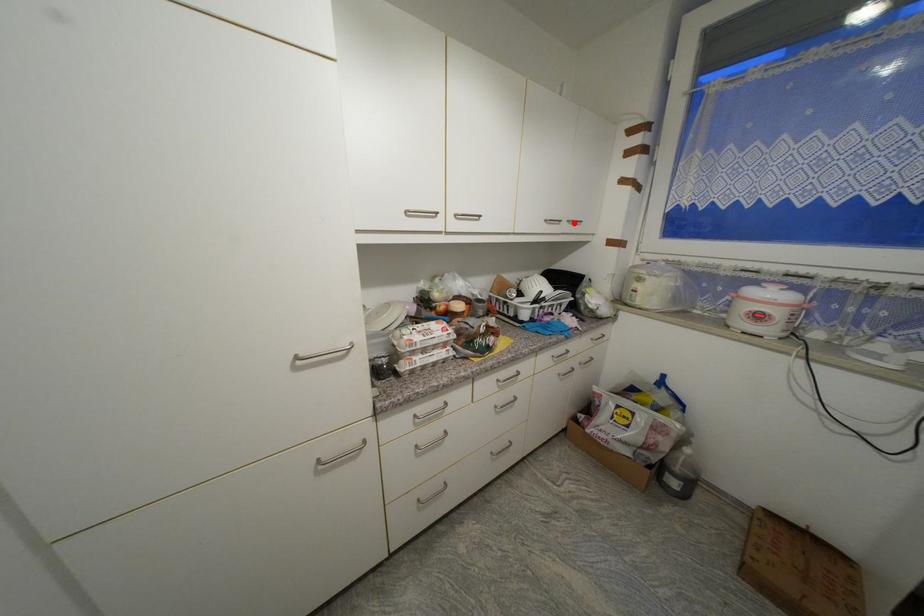
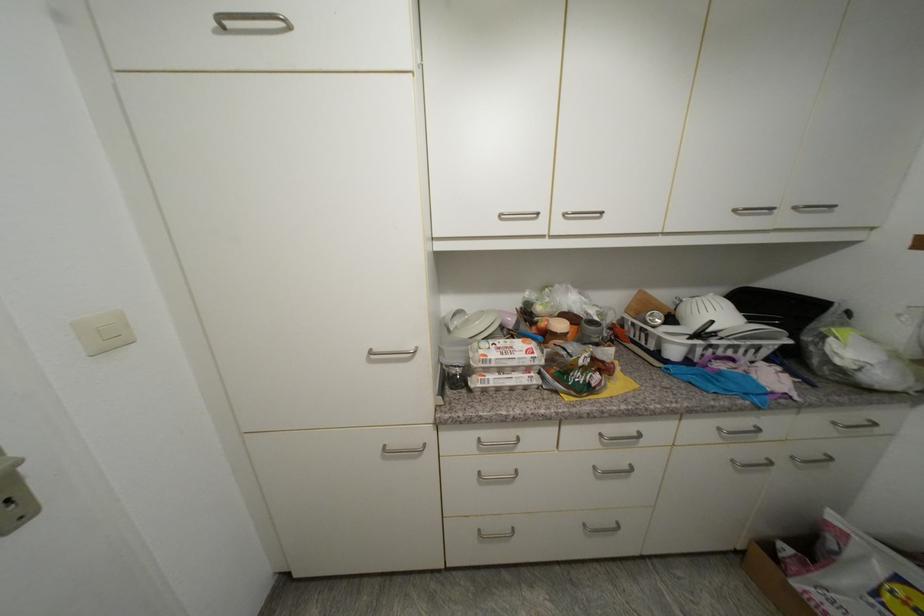
The point at the highlighted location is marked in the first image. Where is the corresponding point in the second image?

(800, 209)